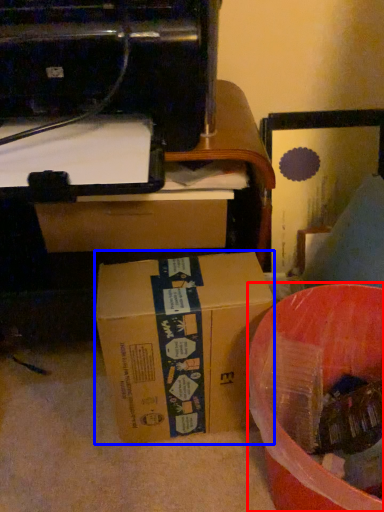
Question: Which of the following is the farthest to the observer, waste (highlighted by a red box) or box (highlighted by a blue box)?

Choices:
 (A) waste
 (B) box

Answer: (B)